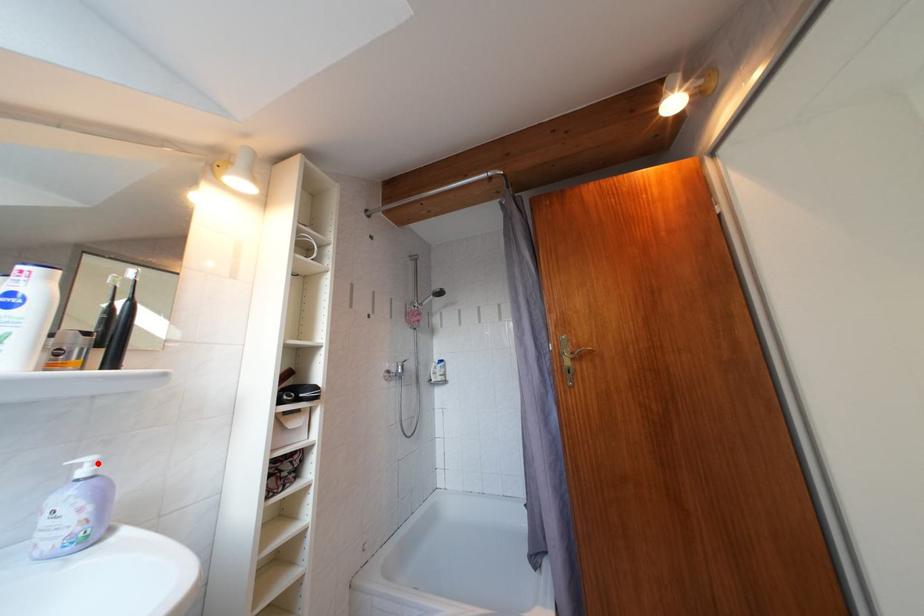
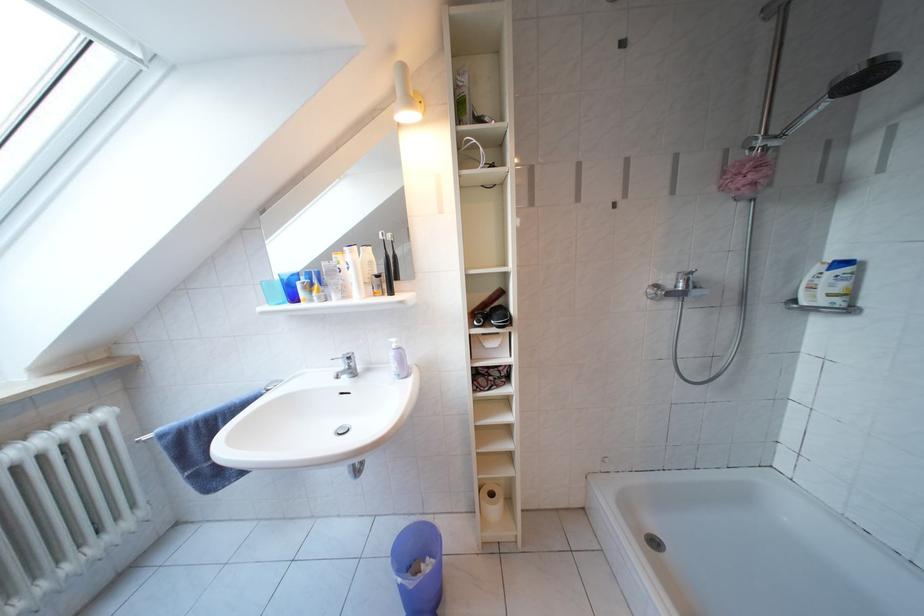
Locate, in the second image, the point that corresponds to the highlighted location in the first image.

(402, 345)